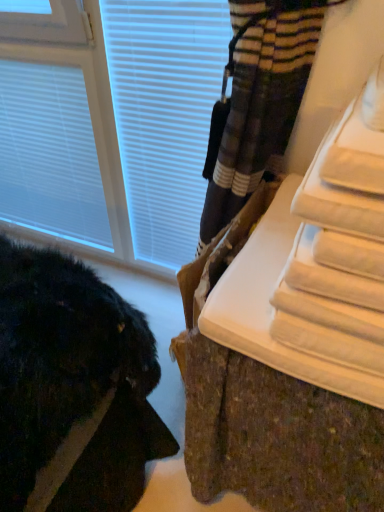
Question: Are white plastic window at upper left and white textured radiator at lower right far apart?

Choices:
 (A) no
 (B) yes

Answer: (A)

Question: Does white plastic window at upper left have a lesser width compared to white textured radiator at lower right?

Choices:
 (A) yes
 (B) no

Answer: (A)

Question: Does white plastic window at upper left have a greater width compared to white textured radiator at lower right?

Choices:
 (A) no
 (B) yes

Answer: (A)

Question: Is white plastic window at upper left at the left side of white textured radiator at lower right?

Choices:
 (A) no
 (B) yes

Answer: (B)

Question: From a real-world perspective, is white plastic window at upper left positioned under white textured radiator at lower right based on gravity?

Choices:
 (A) no
 (B) yes

Answer: (A)

Question: Is white plastic window at upper left oriented away from white textured radiator at lower right?

Choices:
 (A) no
 (B) yes

Answer: (A)

Question: Can you confirm if white matte blind at upper left is smaller than white textured radiator at lower right?

Choices:
 (A) no
 (B) yes

Answer: (B)

Question: From the image's perspective, is white matte blind at upper left above white textured radiator at lower right?

Choices:
 (A) yes
 (B) no

Answer: (A)

Question: Is white matte blind at upper left not inside white textured radiator at lower right?

Choices:
 (A) no
 (B) yes

Answer: (B)

Question: Does white matte blind at upper left appear on the right side of white textured radiator at lower right?

Choices:
 (A) no
 (B) yes

Answer: (A)

Question: From the image's perspective, is white matte blind at upper left under white textured radiator at lower right?

Choices:
 (A) yes
 (B) no

Answer: (B)

Question: Is white matte blind at upper left facing away from white textured radiator at lower right?

Choices:
 (A) yes
 (B) no

Answer: (B)

Question: Is white matte blind at upper left taller than white plastic window at upper left?

Choices:
 (A) no
 (B) yes

Answer: (A)